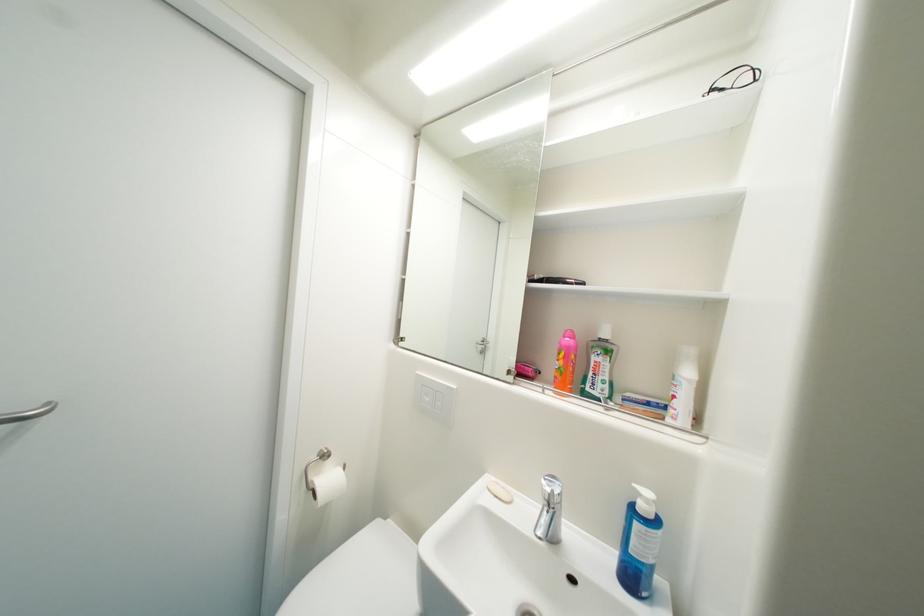
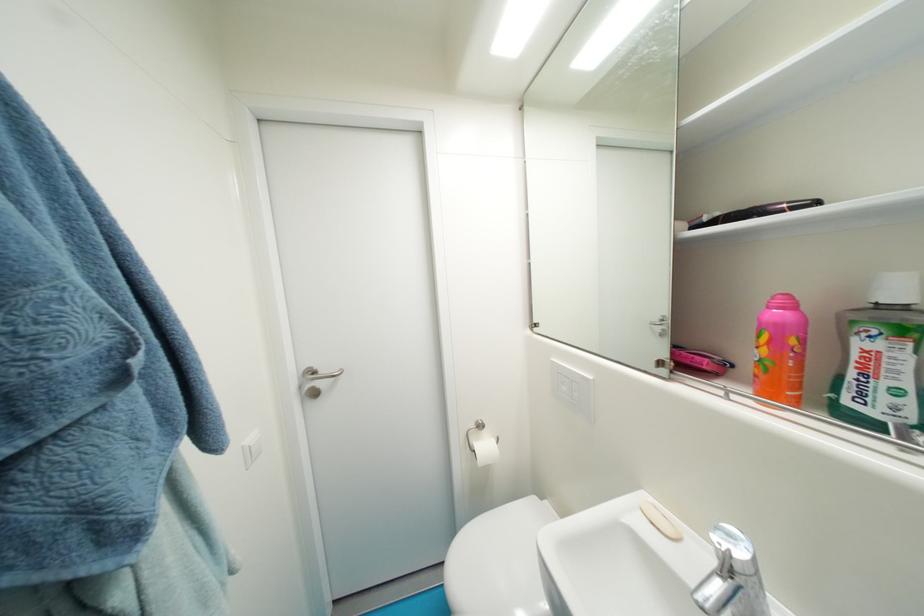
Where in the second image is the point corresponding to (503,498) from the first image?

(659, 525)